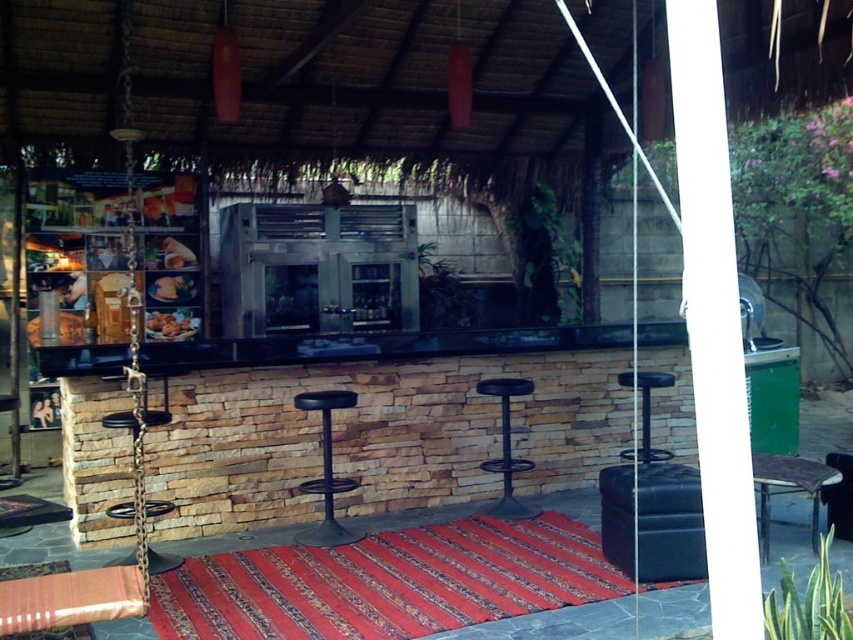
Between point (512, 470) and point (160, 292), which one is positioned in front?

Point (512, 470) is more forward.

Does black metal bar stool at center come behind matte brown bread at center?

No, it is not.

You are a GUI agent. You are given a task and a screenshot of the screen. Output one action in this format:
    pyautogui.click(x=<x>, y=<y>)
    Task: Click on the black metal bar stool at center
    This screenshot has width=853, height=640.
    Given the screenshot: What is the action you would take?
    pyautogui.click(x=506, y=445)

Between black matte bar stool at center and black leather bar stool at center, which one is positioned lower?

black matte bar stool at center

Does point (318, 480) come in front of point (645, 432)?

Yes, it is.

The image size is (853, 640). In order to click on black matte bar stool at center in this screenshot , I will do `click(326, 468)`.

Which of these two, black metal bar stool at center or metallic chain bar stool at center, stands shorter?

Standing shorter between the two is metallic chain bar stool at center.

The height and width of the screenshot is (640, 853). Identify the location of black metal bar stool at center. (506, 445).